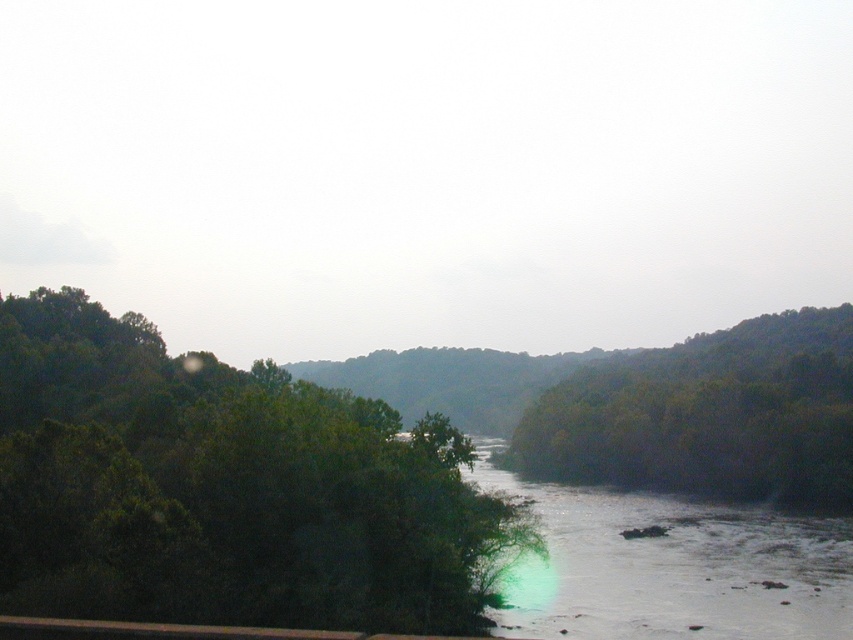
Question: Among these points, which one is farthest from the camera?

Choices:
 (A) (404, 440)
 (B) (772, 609)
 (C) (851, 467)

Answer: (C)

Question: Which object is positioned farthest from the green leafy tree at left?

Choices:
 (A) green leafy trees at right
 (B) clear water at center

Answer: (A)

Question: Is green leafy tree at left smaller than green leafy trees at right?

Choices:
 (A) yes
 (B) no

Answer: (A)

Question: Can you confirm if green leafy tree at left is wider than clear water at center?

Choices:
 (A) yes
 (B) no

Answer: (A)

Question: Which object appears closest to the camera in this image?

Choices:
 (A) green leafy tree at left
 (B) green leafy trees at right

Answer: (A)

Question: Considering the relative positions of green leafy tree at left and green leafy trees at right in the image provided, where is green leafy tree at left located with respect to green leafy trees at right?

Choices:
 (A) right
 (B) left

Answer: (B)